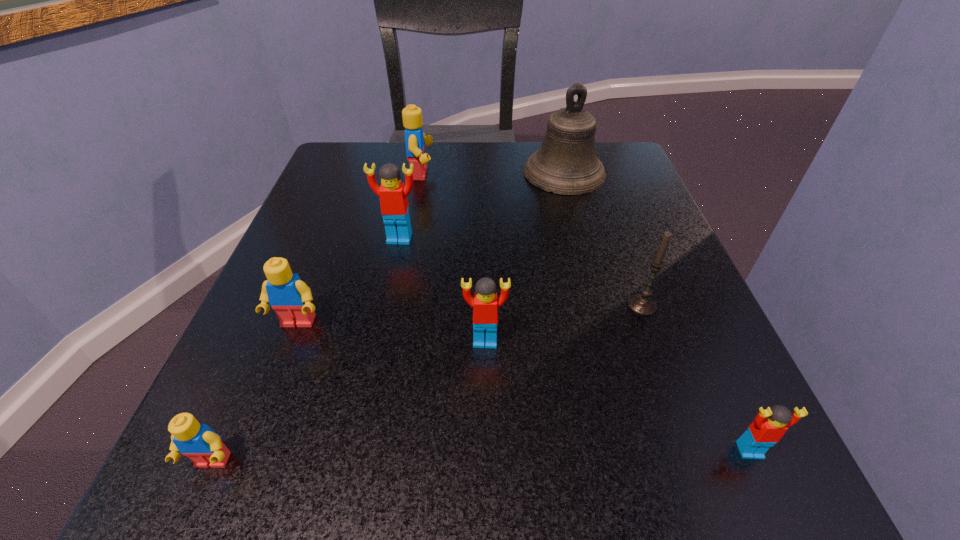
Locate an element on the screen. The height and width of the screenshot is (540, 960). free space that satisfies the following two spatial constraints: 1. on the front-facing side of the farthest yellow Lego; 2. on the face of the fifth nearest Lego is located at coordinates (410, 239).

Identify the location of vacant space that satisfies the following two spatial constraints: 1. on the front-facing side of the rightmost yellow Lego; 2. on the back side of the candle. (398, 305).